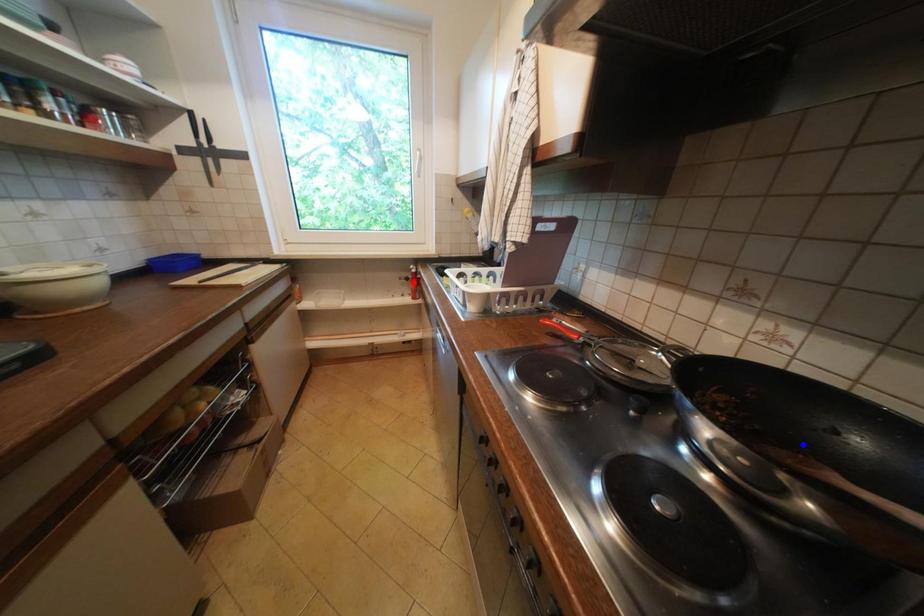
Question: In the image, two points are highlighted. Which point is nearer to the camera? Reply with the corresponding letter.

Choices:
 (A) blue point
 (B) red point

Answer: (A)